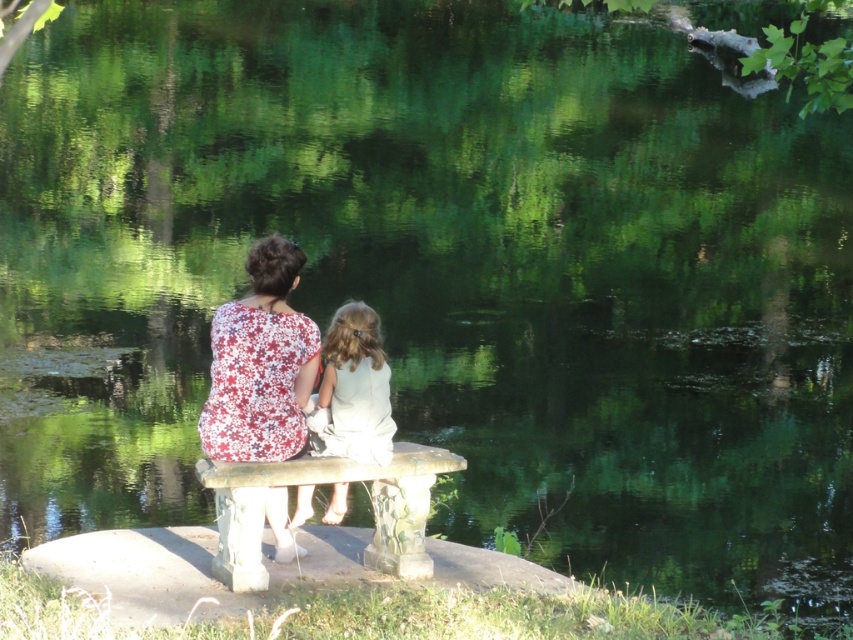
Question: In this image, where is floral fabric blouse at center located relative to white satin dress at center?

Choices:
 (A) left
 (B) right

Answer: (A)

Question: Which point appears farthest from the camera in this image?

Choices:
 (A) (265, 332)
 (B) (360, 385)

Answer: (B)

Question: Which point is farther to the camera?

Choices:
 (A) white satin dress at center
 (B) stone textured bench at center
 (C) floral fabric blouse at center

Answer: (A)

Question: Which is nearer to the stone textured bench at center?

Choices:
 (A) white satin dress at center
 (B) floral fabric blouse at center

Answer: (A)

Question: Can you confirm if stone textured bench at center is smaller than white satin dress at center?

Choices:
 (A) yes
 (B) no

Answer: (B)

Question: Is floral fabric blouse at center smaller than white satin dress at center?

Choices:
 (A) no
 (B) yes

Answer: (A)